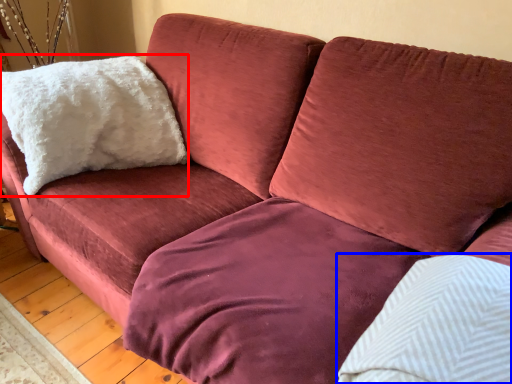
Question: Which of the following is the closest to the observer, pillow (highlighted by a red box) or pillow (highlighted by a blue box)?

Choices:
 (A) pillow
 (B) pillow

Answer: (B)